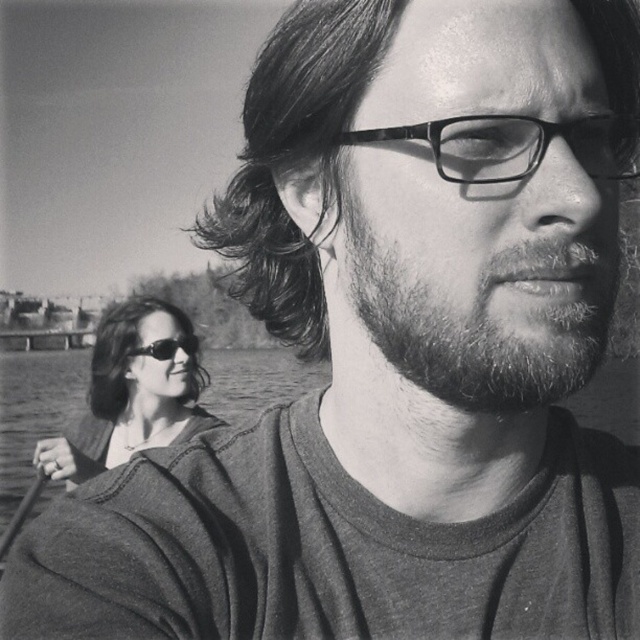
Can you confirm if dark brown textured hair at center is positioned below bearded at center?

Incorrect, dark brown textured hair at center is not positioned below bearded at center.

Between point (637, 3) and point (378, 308), which one is positioned in front?

Point (378, 308) is more forward.

Identify the location of dark brown textured hair at center. (292, 157).

This screenshot has height=640, width=640. What do you see at coordinates (292, 157) in the screenshot?
I see `dark brown textured hair at center` at bounding box center [292, 157].

Who is higher up, dark brown textured hair at center or dark shiny hair at lower left?

dark brown textured hair at center

Does point (333, 136) come closer to viewer compared to point (204, 371)?

Yes, point (333, 136) is closer to viewer.

Image resolution: width=640 pixels, height=640 pixels. In order to click on dark brown textured hair at center in this screenshot , I will do `click(292, 157)`.

Between bearded at center and dark shiny hair at lower left, which one appears on the left side from the viewer's perspective?

dark shiny hair at lower left is more to the left.

Describe the element at coordinates (486, 320) in the screenshot. This screenshot has height=640, width=640. I see `bearded at center` at that location.

Identify the location of bearded at center. (486, 320).